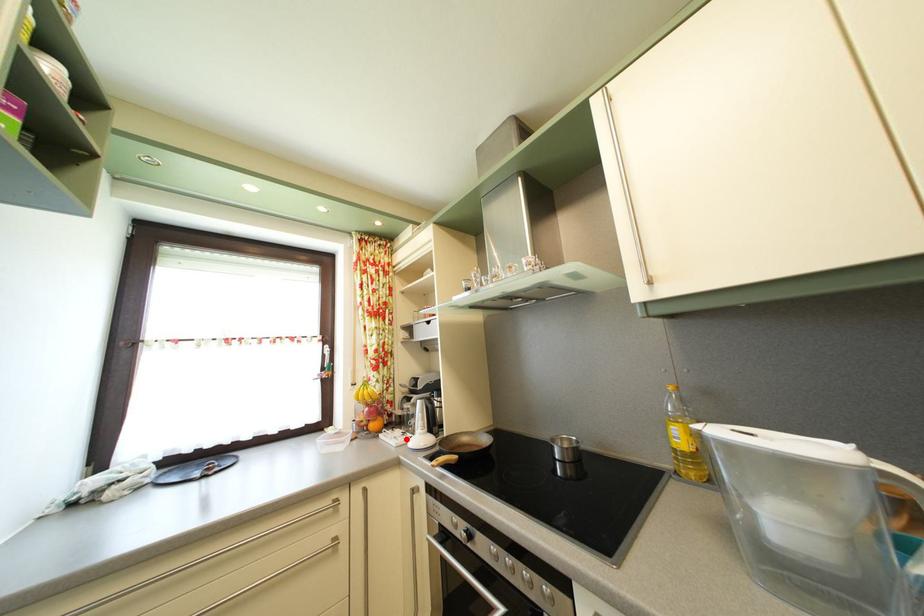
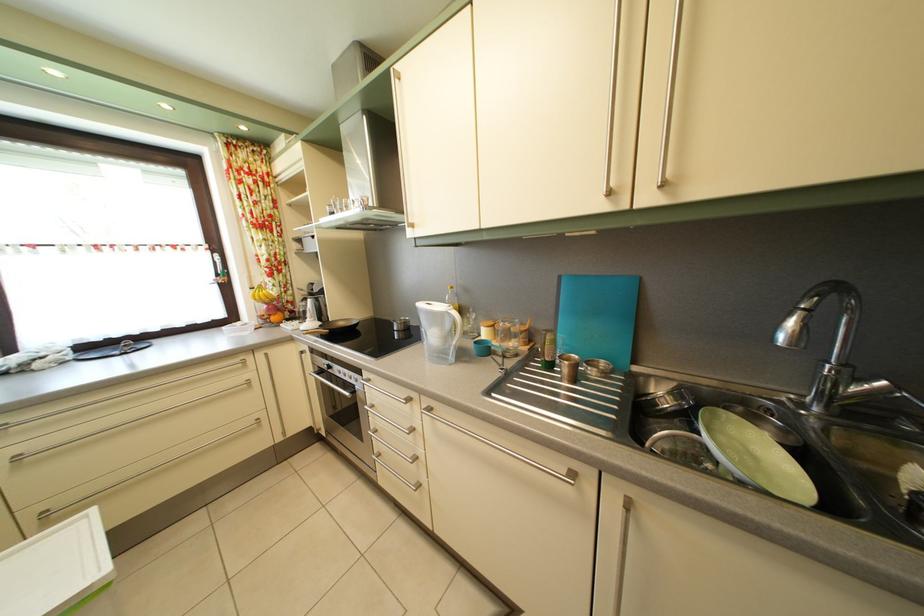
Where in the second image is the point corresponding to the highlighted location from the first image?

(305, 330)